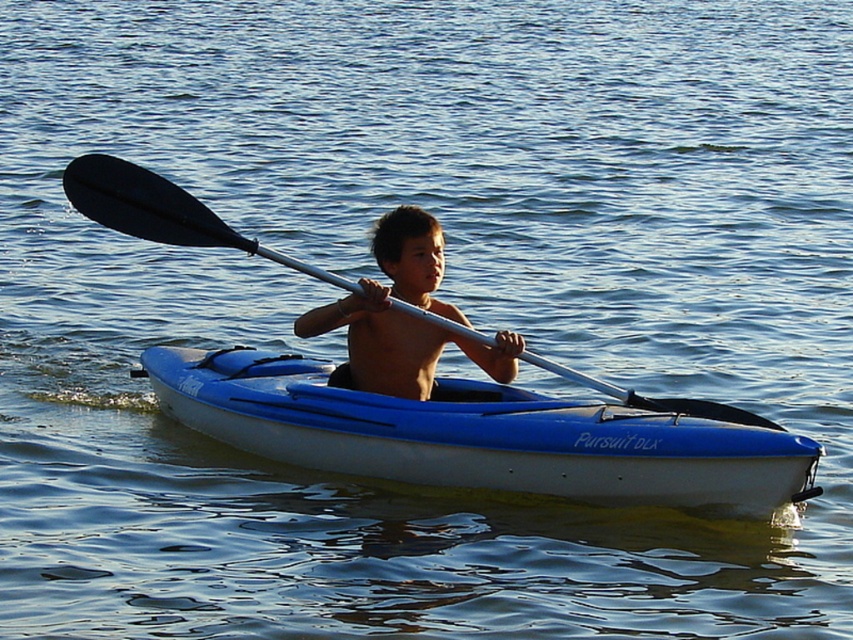
In the scene where a child is paddling a kayak, you notice a smooth skin boy at center and a black rubber paddle at center. Which object is positioned more to the left?

The black rubber paddle at center is positioned more to the left than the smooth skin boy at center.

From the picture: Based on the scene description, can you determine which object is bigger between the smooth skin boy at center and the black rubber paddle at center?

The smooth skin boy at center is larger in size than the black rubber paddle at center according to the description.

Based on the scene description, can you determine if the blue plastic canoe at center is wider than the smooth skin boy at center?

The blue plastic canoe at center might be wider than smooth skin boy at center according to the description.